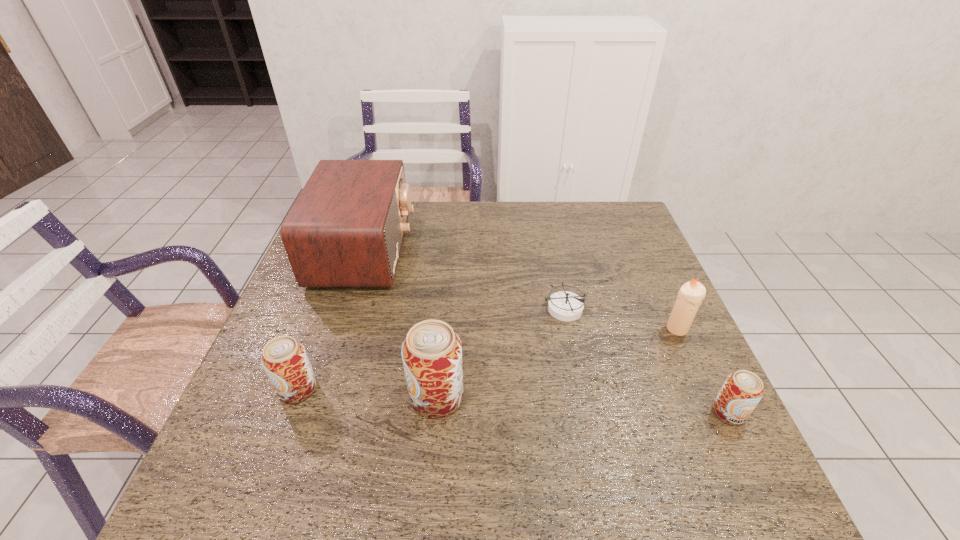
Where is `free area in between the third shortest object and the shortest beer can`? free area in between the third shortest object and the shortest beer can is located at coordinates (513, 401).

Locate an element on the screen. This screenshot has height=540, width=960. blank region between the candle and the radio receiver is located at coordinates (521, 289).

Find the location of a particular element. This screenshot has width=960, height=540. vacant space that is in between the compass and the fourth object from right to left is located at coordinates (500, 353).

Identify the location of empty location between the candle and the rightmost beer can. This screenshot has height=540, width=960. (703, 370).

Locate an element on the screen. The height and width of the screenshot is (540, 960). unoccupied position between the radio receiver and the tallest beer can is located at coordinates (401, 323).

Where is `free point between the farthest object and the tallest beer can`? The height and width of the screenshot is (540, 960). free point between the farthest object and the tallest beer can is located at coordinates (401, 323).

The width and height of the screenshot is (960, 540). In order to click on vacant region between the candle and the shortest object in this screenshot , I will do `click(621, 319)`.

The width and height of the screenshot is (960, 540). Find the location of `vacant region between the candle and the farthest object`. vacant region between the candle and the farthest object is located at coordinates (521, 289).

At what (x,y) coordinates should I click in order to perform the action: click on object identified as the second closest to the compass. Please return your answer as a coordinate pair (x, y). Looking at the image, I should click on (432, 352).

Find the location of `the fifth closest object to the tallest beer can`. the fifth closest object to the tallest beer can is located at coordinates (741, 392).